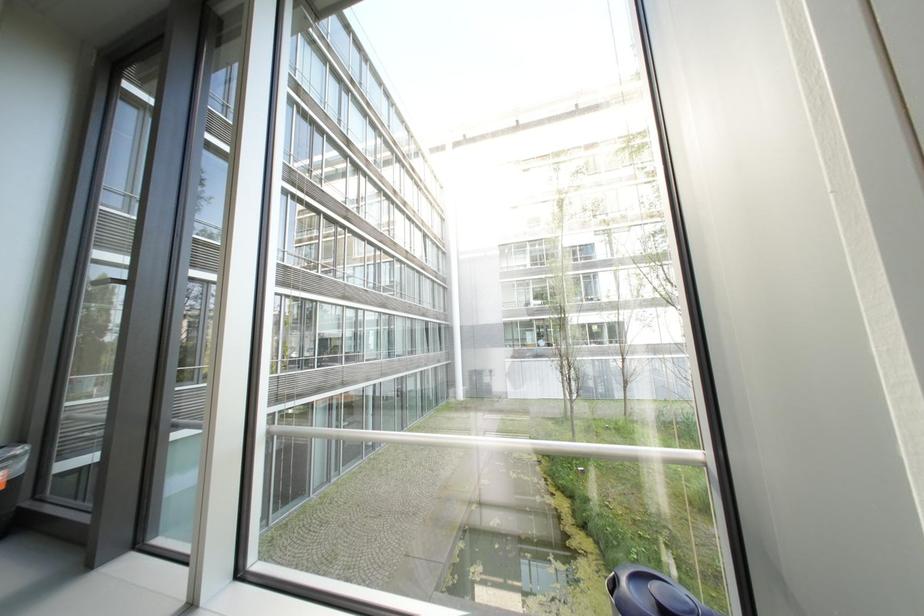
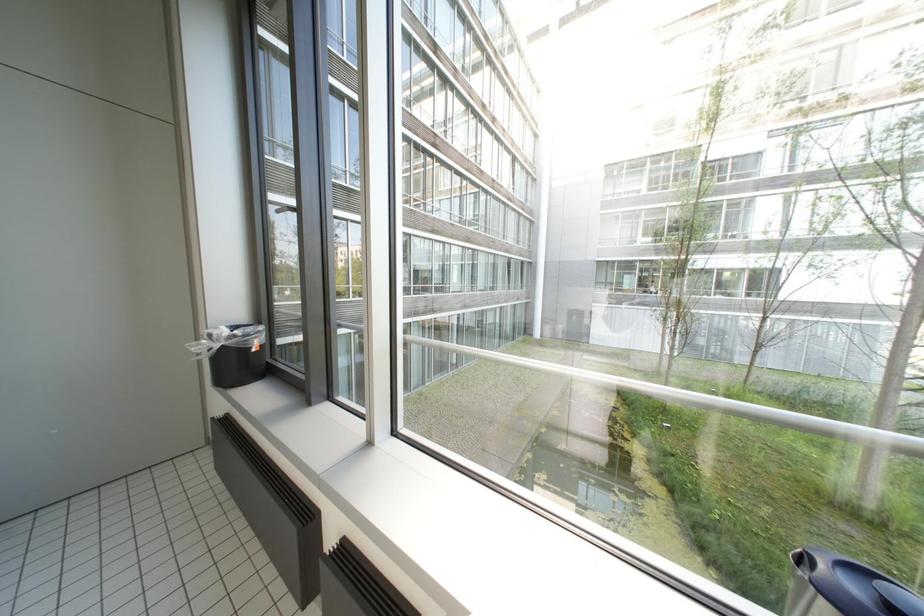
Question: Based on the continuous images, in which direction is the camera rotating? Reply with the corresponding letter.

Choices:
 (A) Left
 (B) Right
 (C) Up
 (D) Down

Answer: (A)